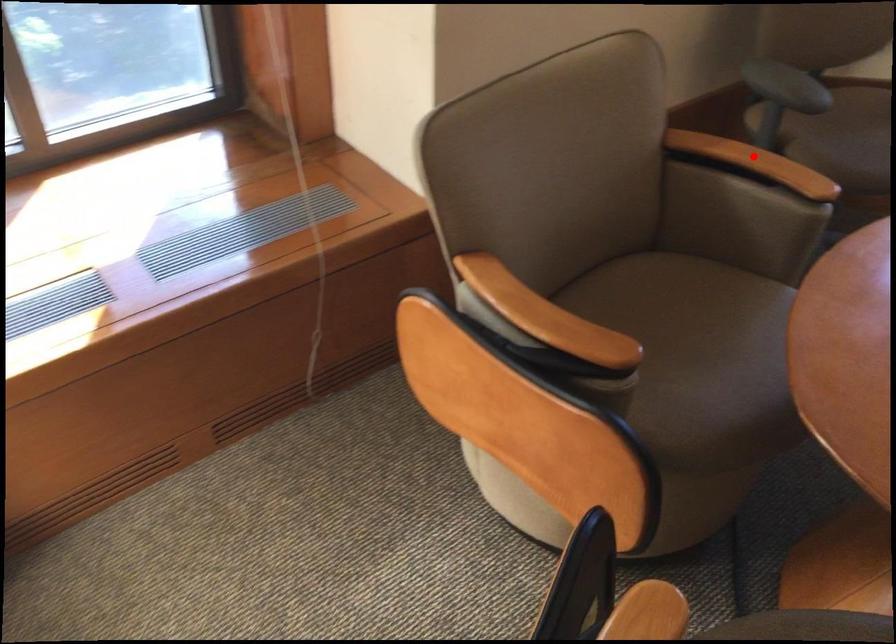
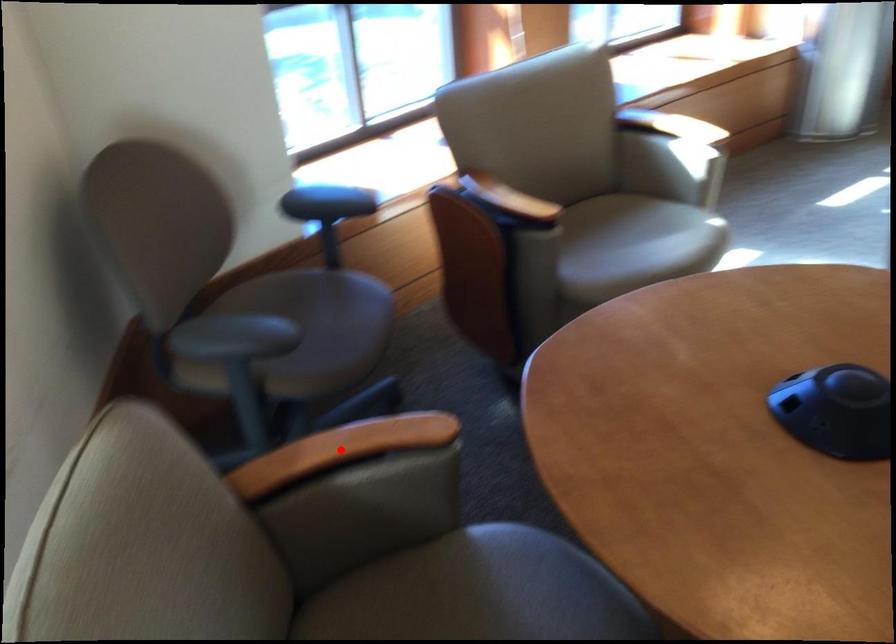
I am providing you with two images of the same scene from different viewpoints. A red point is marked on the first image and another point is marked on the second image. Is the marked point in image1 the same physical position as the marked point in image2?

Yes